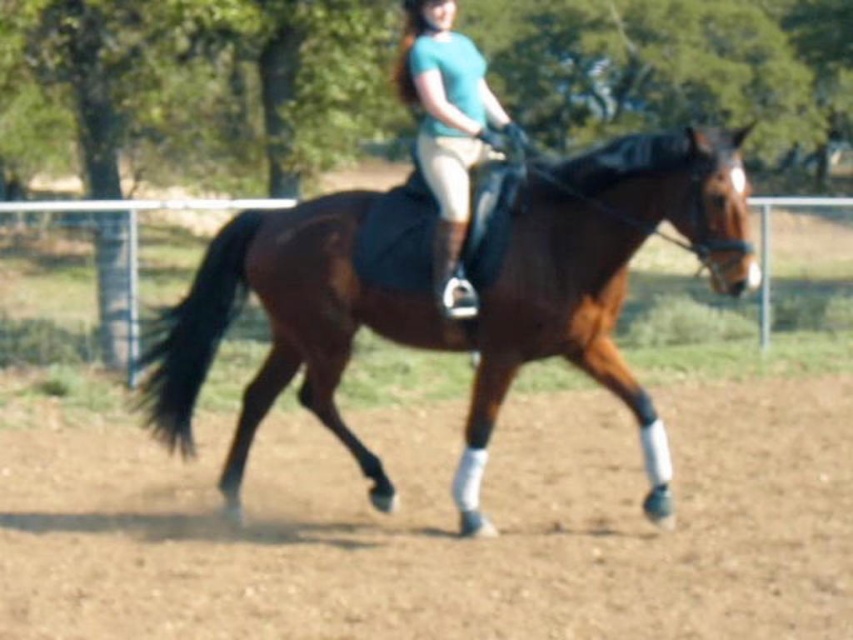
Question: Does brown dirt field at center appear on the left side of brown glossy horse at center?

Choices:
 (A) no
 (B) yes

Answer: (A)

Question: Which point is closer to the camera?

Choices:
 (A) matte teal shirt at center
 (B) brown dirt field at center

Answer: (B)

Question: Can you confirm if brown dirt field at center is thinner than brown glossy horse at center?

Choices:
 (A) no
 (B) yes

Answer: (A)

Question: Considering the real-world distances, which object is farthest from the brown glossy horse at center?

Choices:
 (A) brown dirt field at center
 (B) matte teal shirt at center

Answer: (A)

Question: Observing the image, what is the correct spatial positioning of brown dirt field at center in reference to brown glossy horse at center?

Choices:
 (A) below
 (B) above

Answer: (A)

Question: Which object is positioned farthest from the brown glossy horse at center?

Choices:
 (A) brown dirt field at center
 (B) matte teal shirt at center

Answer: (A)